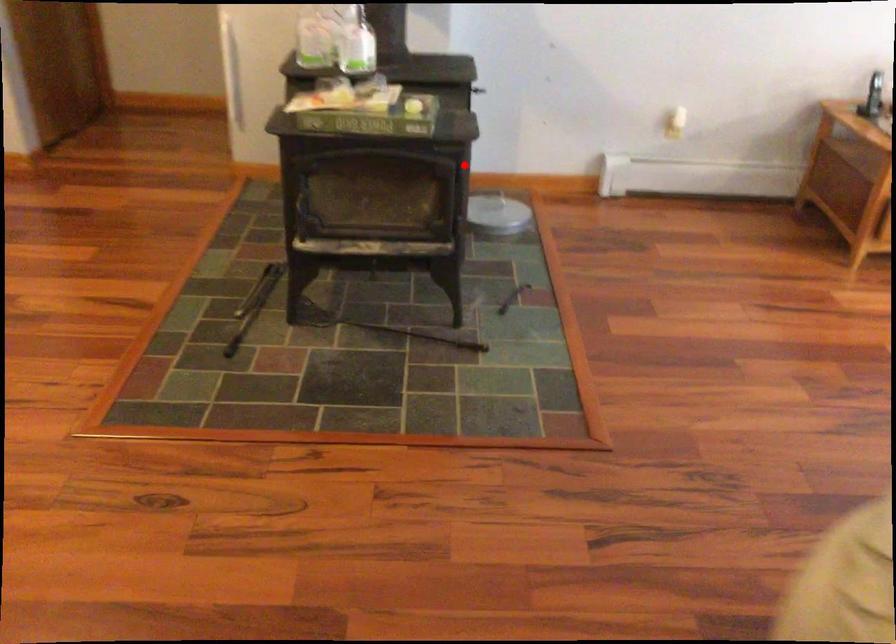
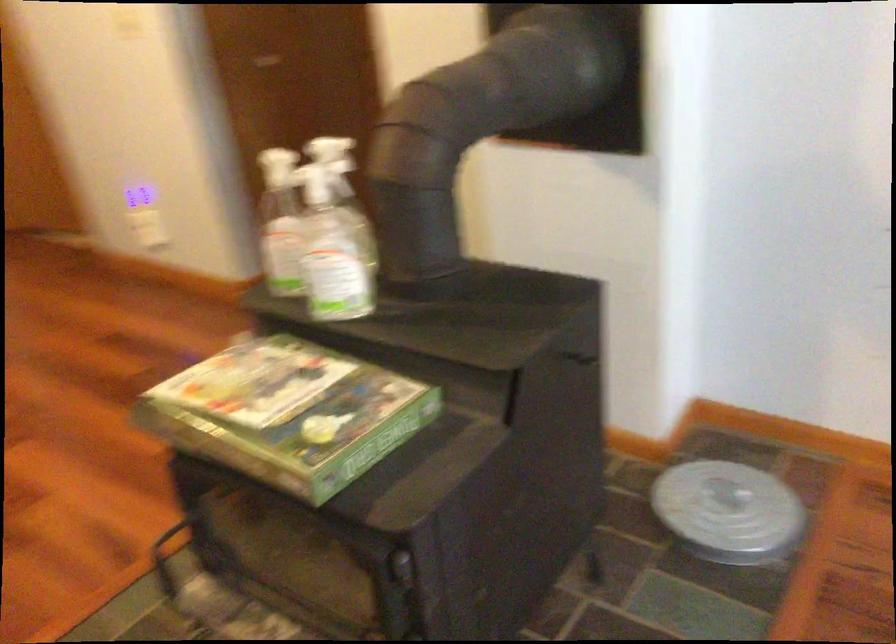
Find the pixel in the second image that matches the highlighted location in the first image.

(401, 567)